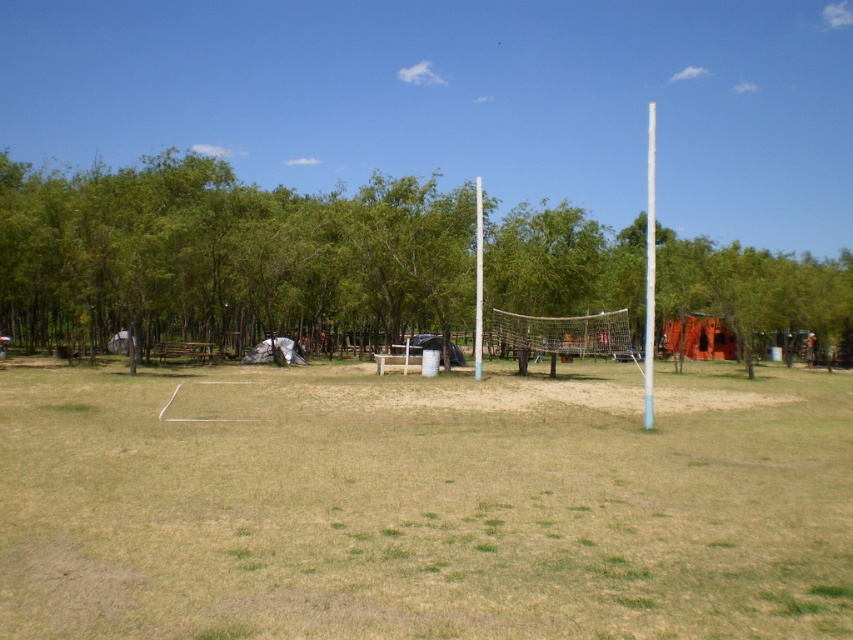
Question: Is green grass at center positioned behind blue plastic pole at right?

Choices:
 (A) yes
 (B) no

Answer: (B)

Question: Among these points, which one is farthest from the camera?

Choices:
 (A) (647, 244)
 (B) (480, 218)

Answer: (A)

Question: Which point appears farthest from the camera in this image?

Choices:
 (A) (643, 353)
 (B) (781, 465)
 (C) (189, 164)
 (D) (474, 241)

Answer: (C)

Question: Is green grass at center positioned before green leafy tree at center?

Choices:
 (A) yes
 (B) no

Answer: (A)

Question: Among these points, which one is nearest to the camera?

Choices:
 (A) (65, 237)
 (B) (477, 198)
 (C) (85, 488)

Answer: (C)

Question: Does green grass at center have a lesser width compared to green leafy tree at center?

Choices:
 (A) yes
 (B) no

Answer: (A)